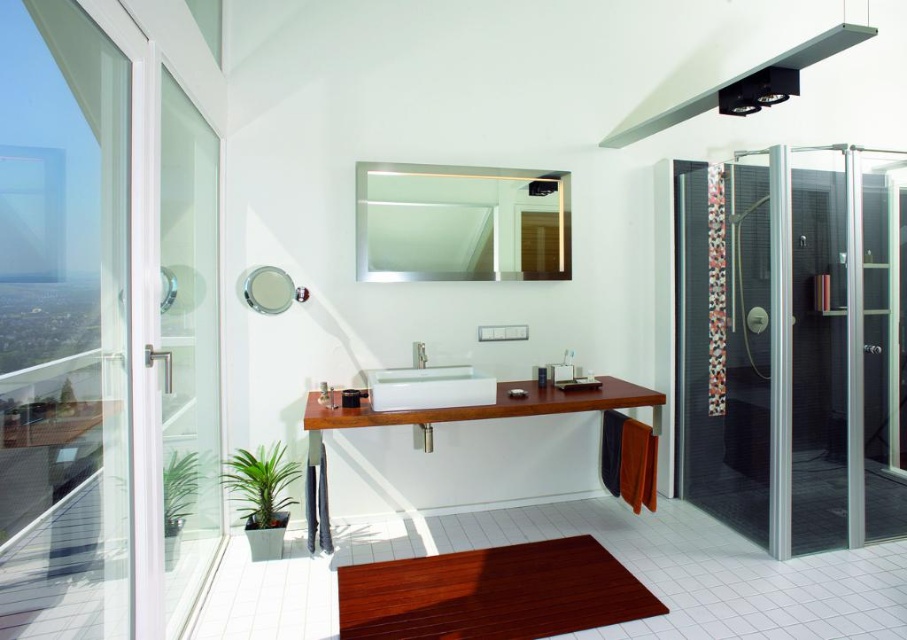
Can you confirm if transparent glass shower door at right is positioned above white glossy sink at center?

Yes, transparent glass shower door at right is above white glossy sink at center.

In the scene shown: Between transparent glass shower door at right and white glossy sink at center, which one has less height?

With less height is white glossy sink at center.

Between point (889, 456) and point (490, 397), which one is positioned in front?

Point (490, 397) is more forward.

Where is `transparent glass shower door at right`? The width and height of the screenshot is (907, 640). transparent glass shower door at right is located at coordinates pos(790,348).

Can you confirm if teak wood vanity at center is positioned below satin nickel faucet at center?

Correct, teak wood vanity at center is located below satin nickel faucet at center.

Does point (320, 413) come in front of point (418, 346)?

Yes, it is.

At what (x,y) coordinates should I click in order to perform the action: click on teak wood vanity at center. Please return your answer as a coordinate pair (x, y). Image resolution: width=907 pixels, height=640 pixels. Looking at the image, I should click on (449, 420).

Can you confirm if transparent glass shower door at right is positioned to the right of teak wood vanity at center?

Indeed, transparent glass shower door at right is positioned on the right side of teak wood vanity at center.

Consider the image. Who is more forward, (735,234) or (320,465)?

Point (320,465)

You are a GUI agent. You are given a task and a screenshot of the screen. Output one action in this format:
    pyautogui.click(x=<x>, y=<y>)
    Task: Click on the transparent glass shower door at right
    The image size is (907, 640).
    Given the screenshot: What is the action you would take?
    pyautogui.click(x=790, y=348)